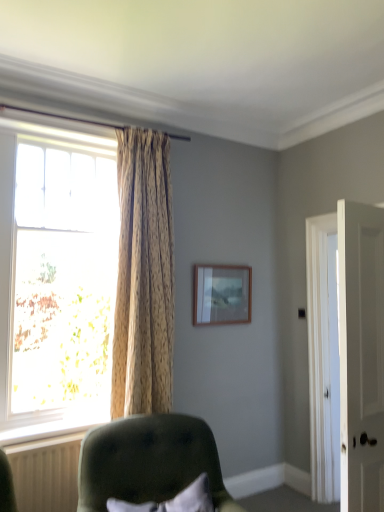
Measure the distance between point (354, 218) and camera.

Point (354, 218) is 2.13 meters away from camera.

Where is `white plastic radiator at lower left`? The width and height of the screenshot is (384, 512). white plastic radiator at lower left is located at coordinates (46, 473).

The image size is (384, 512). I want to click on white smooth door at right, so click(361, 355).

The height and width of the screenshot is (512, 384). In order to click on picture frame located below the translucent glass window at left (from the image's perspective) in this screenshot , I will do `click(222, 294)`.

Is point (34, 391) closer to camera compared to point (217, 269)?

Yes, it is in front of point (217, 269).

Looking at this image, from a real-world perspective, relative to wooden frame at upper center, is translucent glass window at left vertically above or below?

Clearly, from a real-world perspective, translucent glass window at left is above wooden frame at upper center.

Is translucent glass window at left bigger than wooden frame at upper center?

Yes, translucent glass window at left is bigger than wooden frame at upper center.

How far apart are white plastic radiator at lower left and velvet green chair at lower center?

Answer: 15.86 inches.

Which of these two, white plastic radiator at lower left or velvet green chair at lower center, is wider?

velvet green chair at lower center is wider.

Is white plastic radiator at lower left placed right next to velvet green chair at lower center?

white plastic radiator at lower left and velvet green chair at lower center are clearly separated.

Between white plastic radiator at lower left and velvet green chair at lower center, which one appears on the left side from the viewer's perspective?

Positioned to the left is white plastic radiator at lower left.

Is floral fabric curtain at left facing towards translucent glass window at left?

No.

Considering the positions of objects floral fabric curtain at left and translucent glass window at left in the image provided, who is in front, floral fabric curtain at left or translucent glass window at left?

Positioned in front is translucent glass window at left.

Is the surface of floral fabric curtain at left in direct contact with translucent glass window at left?

No, floral fabric curtain at left is not making contact with translucent glass window at left.

Considering the sizes of objects floral fabric curtain at left and translucent glass window at left in the image provided, who is shorter, floral fabric curtain at left or translucent glass window at left?

Standing shorter between the two is floral fabric curtain at left.

Could you tell me if velvet green chair at lower center is facing white smooth door at right?

No.

Looking at their sizes, would you say velvet green chair at lower center is wider or thinner than white smooth door at right?

velvet green chair at lower center is wider than white smooth door at right.

Would you consider velvet green chair at lower center to be distant from white smooth door at right?

velvet green chair at lower center is positioned a significant distance from white smooth door at right.

Is white smooth door at right completely or partially inside velvet green chair at lower center?

No, velvet green chair at lower center does not contain white smooth door at right.

From the image's perspective, which one is positioned higher, velvet green chair at lower center or wooden frame at upper center?

wooden frame at upper center, from the image's perspective.

Which point is more forward, (141, 474) or (247, 320)?

The point (141, 474) is closer.

How different are the orientations of velvet green chair at lower center and wooden frame at upper center in degrees?

The facing directions of velvet green chair at lower center and wooden frame at upper center are 17.4 degrees apart.

From a real-world perspective, which object rests below the other?

From a 3D spatial view, velvet green chair at lower center is below.

Between soft white pillow at lower center and velvet green chair at lower center, which one has more height?

Standing taller between the two is velvet green chair at lower center.

You are a GUI agent. You are given a task and a screenshot of the screen. Output one action in this format:
    pyautogui.click(x=<x>, y=<y>)
    Task: Click on the chair above the soft white pillow at lower center (from a real-world perspective)
    This screenshot has width=384, height=512.
    Given the screenshot: What is the action you would take?
    pyautogui.click(x=148, y=461)

Is soft white pillow at lower center facing towards velvet green chair at lower center?

Yes, soft white pillow at lower center is oriented towards velvet green chair at lower center.

Are soft white pillow at lower center and velvet green chair at lower center making contact?

No, soft white pillow at lower center is not next to velvet green chair at lower center.

Which of these two, velvet green chair at lower center or soft white pillow at lower center, is thinner?

Thinner between the two is soft white pillow at lower center.

Does velvet green chair at lower center lie in front of soft white pillow at lower center?

Yes, it is in front of soft white pillow at lower center.

Could you tell me if velvet green chair at lower center is facing soft white pillow at lower center?

Yes, velvet green chair at lower center is turned towards soft white pillow at lower center.

Which of these two, velvet green chair at lower center or soft white pillow at lower center, stands taller?

velvet green chair at lower center is taller.

Image resolution: width=384 pixels, height=512 pixels. In the image, there is a translucent glass window at left. In order to click on picture frame below it (from the image's perspective) in this screenshot , I will do `click(222, 294)`.

The image size is (384, 512). What are the coordinates of `chair in front of the white plastic radiator at lower left` in the screenshot? It's located at (148, 461).

From the image, which object appears to be farther from velvet green chair at lower center, translucent glass window at left or wooden frame at upper center?

wooden frame at upper center lies further to velvet green chair at lower center than the other object.

Looking at the image, which one is located further to translucent glass window at left, wooden frame at upper center or soft white pillow at lower center?

Based on the image, soft white pillow at lower center appears to be further to translucent glass window at left.

When comparing their distances from translucent glass window at left, does white plastic radiator at lower left or floral fabric curtain at left seem further?

The object further to translucent glass window at left is white plastic radiator at lower left.

Based on their spatial positions, is translucent glass window at left or white smooth door at right closer to floral fabric curtain at left?

translucent glass window at left lies closer to floral fabric curtain at left than the other object.

Which object lies further to the anchor point translucent glass window at left, white smooth door at right or white plastic radiator at lower left?

white smooth door at right is further to translucent glass window at left.

When comparing their distances from soft white pillow at lower center, does white smooth door at right or wooden frame at upper center seem closer?

Based on the image, white smooth door at right appears to be nearer to soft white pillow at lower center.

From the picture: Which object lies further to the anchor point soft white pillow at lower center, floral fabric curtain at left or translucent glass window at left?

translucent glass window at left lies further to soft white pillow at lower center than the other object.

Considering their positions, is floral fabric curtain at left positioned further to velvet green chair at lower center than soft white pillow at lower center?

floral fabric curtain at left is further to velvet green chair at lower center.

The width and height of the screenshot is (384, 512). I want to click on chair that lies between floral fabric curtain at left and soft white pillow at lower center from top to bottom, so click(148, 461).

Identify the location of radiator between velvet green chair at lower center and wooden frame at upper center from front to back. (46, 473).

Image resolution: width=384 pixels, height=512 pixels. I want to click on chair that lies between translucent glass window at left and soft white pillow at lower center from top to bottom, so click(x=148, y=461).

You are a GUI agent. You are given a task and a screenshot of the screen. Output one action in this format:
    pyautogui.click(x=<x>, y=<y>)
    Task: Click on the chair between white plastic radiator at lower left and white smooth door at right
    
    Given the screenshot: What is the action you would take?
    click(x=148, y=461)